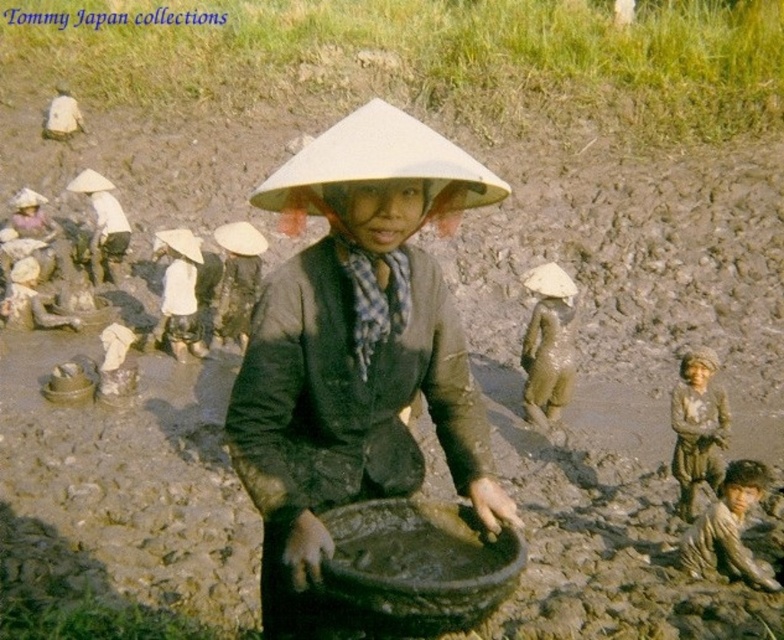
Question: Among these points, which one is farthest from the camera?

Choices:
 (A) (155, 332)
 (B) (220, 241)
 (C) (56, 106)
 (D) (372, 419)

Answer: (C)

Question: Is matte black bowl at center to the left of dirty brown skin at lower right from the viewer's perspective?

Choices:
 (A) yes
 (B) no

Answer: (A)

Question: Can you confirm if matte black bowl at center is thinner than white fabric hat at upper left?

Choices:
 (A) yes
 (B) no

Answer: (B)

Question: Which point is closer to the camera taking this photo?

Choices:
 (A) (57, 124)
 (B) (561, 360)
 (C) (445, 328)
 (D) (748, 504)

Answer: (C)

Question: Among these points, which one is nearest to the camera?

Choices:
 (A) (184, 253)
 (B) (360, 145)

Answer: (B)

Question: Can you confirm if muddy skin at center is thinner than white fabric hat at center?

Choices:
 (A) no
 (B) yes

Answer: (B)